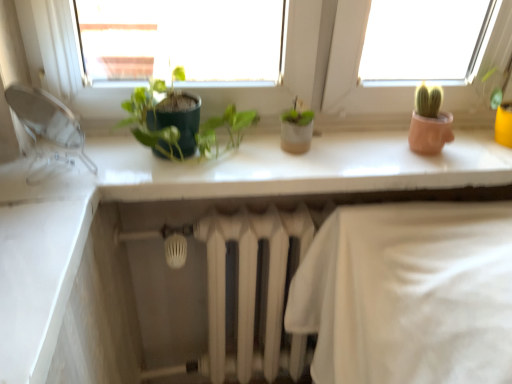
Question: From the image's perspective, is transparent plastic faucet at left located above or below white glossy counter top at upper center?

Choices:
 (A) above
 (B) below

Answer: (A)

Question: Considering their positions, is transparent plastic faucet at left located in front of or behind white glossy counter top at upper center?

Choices:
 (A) front
 (B) behind

Answer: (A)

Question: Estimate the real-world distances between objects in this image. Which object is farther from the green matte plant at center?

Choices:
 (A) white glossy counter top at upper center
 (B) transparent plastic faucet at left

Answer: (B)

Question: Based on their relative distances, which object is nearer to the transparent plastic faucet at left?

Choices:
 (A) green matte plant at center
 (B) white glossy counter top at upper center

Answer: (A)